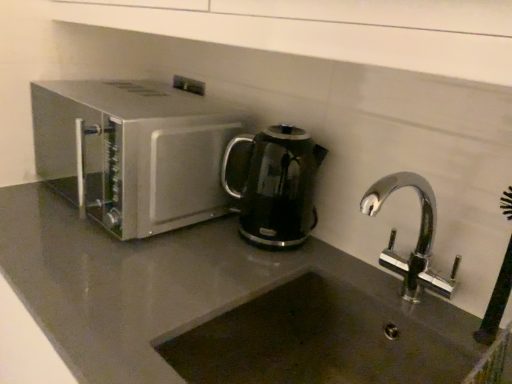
Question: Can you confirm if satin silver microwave at left is positioned to the right of dark gray stone sink at lower center?

Choices:
 (A) no
 (B) yes

Answer: (A)

Question: Does satin silver microwave at left turn towards dark gray stone sink at lower center?

Choices:
 (A) no
 (B) yes

Answer: (A)

Question: Is satin silver microwave at left further to camera compared to dark gray stone sink at lower center?

Choices:
 (A) yes
 (B) no

Answer: (A)

Question: Can dark gray stone sink at lower center be found inside satin silver microwave at left?

Choices:
 (A) no
 (B) yes

Answer: (A)

Question: Is satin silver microwave at left not near dark gray stone sink at lower center?

Choices:
 (A) yes
 (B) no

Answer: (B)

Question: Visually, is black glossy electric kettle at center positioned to the left or to the right of dark gray stone sink at lower center?

Choices:
 (A) right
 (B) left

Answer: (B)

Question: Considering their positions, is black glossy electric kettle at center located in front of or behind dark gray stone sink at lower center?

Choices:
 (A) front
 (B) behind

Answer: (B)

Question: Is black glossy electric kettle at center inside or outside of dark gray stone sink at lower center?

Choices:
 (A) outside
 (B) inside

Answer: (A)

Question: Considering the positions of point (280, 244) and point (411, 258), is point (280, 244) closer or farther from the camera than point (411, 258)?

Choices:
 (A) farther
 (B) closer

Answer: (A)

Question: Visually, is satin silver microwave at left positioned to the left or to the right of dark gray stone sink at lower center?

Choices:
 (A) left
 (B) right

Answer: (A)

Question: From the image's perspective, is satin silver microwave at left above or below dark gray stone sink at lower center?

Choices:
 (A) above
 (B) below

Answer: (A)

Question: Considering their positions, is satin silver microwave at left located in front of or behind dark gray stone sink at lower center?

Choices:
 (A) front
 (B) behind

Answer: (B)

Question: Which is correct: satin silver microwave at left is inside dark gray stone sink at lower center, or outside of it?

Choices:
 (A) outside
 (B) inside

Answer: (A)

Question: Looking at their shapes, would you say dark gray stone sink at lower center is wider or thinner than satin silver microwave at left?

Choices:
 (A) thin
 (B) wide

Answer: (B)

Question: From a real-world perspective, is dark gray stone sink at lower center positioned above or below satin silver microwave at left?

Choices:
 (A) below
 (B) above

Answer: (A)